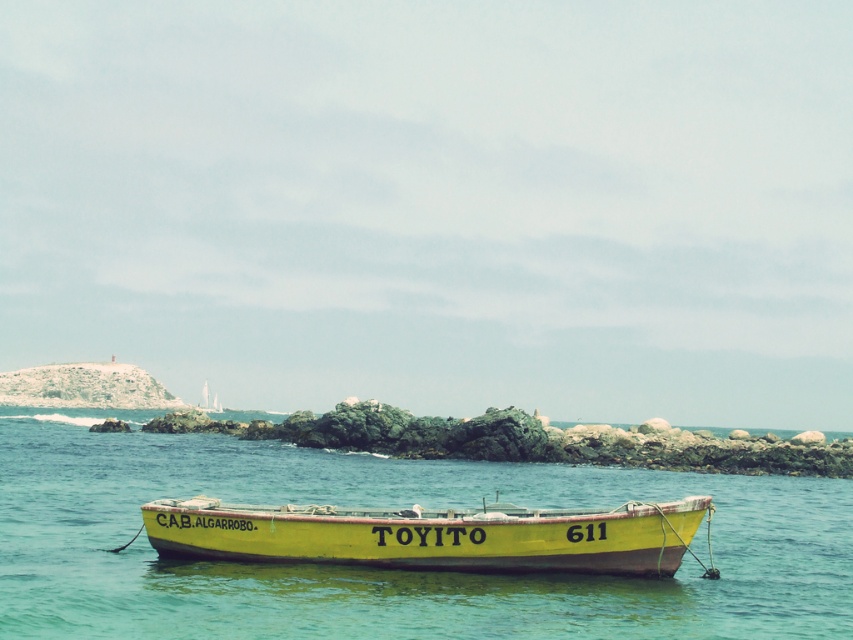
You are a photographer planning to capture the yellow matte boat at center and the turquoise water at center in a single frame. Based on the scene, which object appears larger in the image?

The turquoise water at center appears larger because it is much taller than the yellow matte boat at center.

You are standing on the rocky shoreline and want to take a photo of the yellow matte boat at center. The turquoise water at center is blocking your view. Can you move to a position where the boat is visible without the water obstructing it?

The turquoise water at center is closer to the viewer than the yellow matte boat at center, so moving to a higher elevation or shifting your position to the side might allow you to see the boat over or around the water.